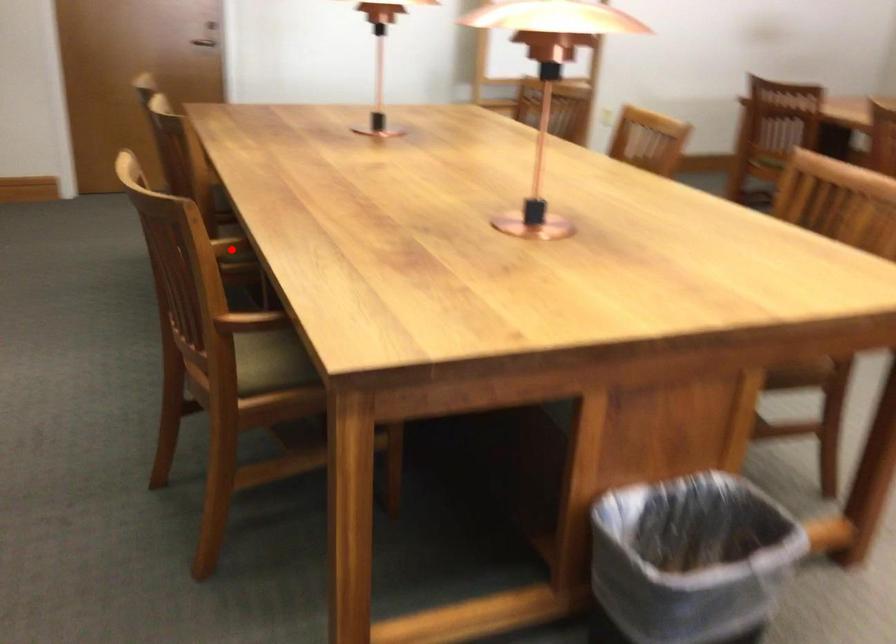
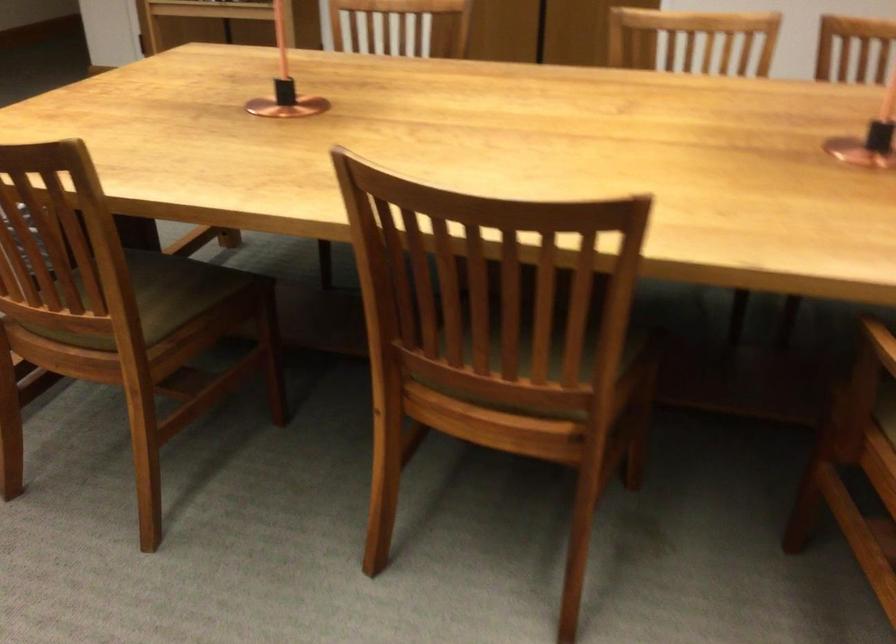
Question: I am providing you with two images of the same scene from different viewpoints. A red point is marked on the first image. Is the red point's position out of view in image 2?

Choices:
 (A) Yes
 (B) No

Answer: (A)